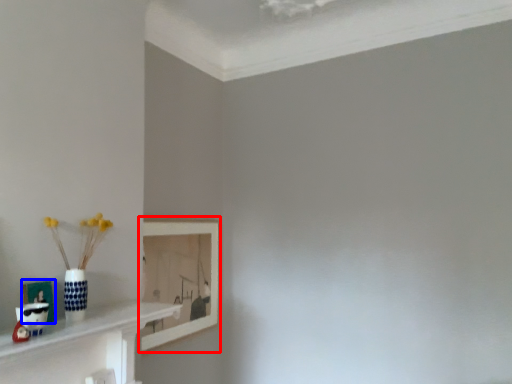
Question: Which object appears farthest to the camera in this image, picture frame (highlighted by a red box) or picture frame (highlighted by a blue box)?

Choices:
 (A) picture frame
 (B) picture frame

Answer: (A)